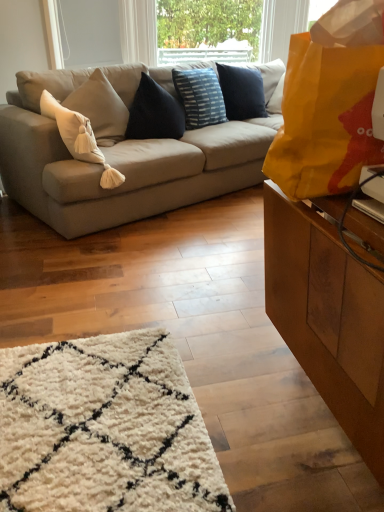
Describe the element at coordinates (200, 97) in the screenshot. I see `blue striped cushion at center, positioned as the 1th pillow in back-to-front order` at that location.

The width and height of the screenshot is (384, 512). What do you see at coordinates (329, 103) in the screenshot?
I see `yellow paper bag at right` at bounding box center [329, 103].

You are a GUI agent. You are given a task and a screenshot of the screen. Output one action in this format:
    pyautogui.click(x=<x>, y=<y>)
    Task: Click on the blue striped cushion at center, which is the 2th pillow from left to right
    
    Given the screenshot: What is the action you would take?
    [200, 97]

Which is correct: yellow paper bag at right is inside white soft cushion at left, acting as the second pillow starting from the back, or outside of it?

yellow paper bag at right lies outside white soft cushion at left, acting as the second pillow starting from the back.

Considering the points (310, 116) and (43, 104), which point is in front, point (310, 116) or point (43, 104)?

The point (310, 116) is in front.

How much distance is there between yellow paper bag at right and white soft cushion at left, acting as the second pillow starting from the back?

yellow paper bag at right and white soft cushion at left, acting as the second pillow starting from the back, are 4.88 feet apart from each other.

Based on the photo, considering the positions of objects blue striped cushion at center, which is the 2th pillow from left to right, and white soft cushion at left, the first pillow viewed from the front, in the image provided, who is more to the left, blue striped cushion at center, which is the 2th pillow from left to right, or white soft cushion at left, the first pillow viewed from the front,?

From the viewer's perspective, white soft cushion at left, the first pillow viewed from the front, appears more on the left side.

Locate an element on the screen. The width and height of the screenshot is (384, 512). pillow above the white soft cushion at left, the first pillow viewed from the front (from the image's perspective) is located at coordinates (200, 97).

From the image's perspective, is blue striped cushion at center, arranged as the second pillow when viewed from the front, located beneath white soft cushion at left, acting as the second pillow starting from the back?

Actually, blue striped cushion at center, arranged as the second pillow when viewed from the front, appears above white soft cushion at left, acting as the second pillow starting from the back, in the image.

Considering the sizes of objects white soft cushion at left, the first pillow viewed from the front, and yellow paper bag at right in the image provided, who is taller, white soft cushion at left, the first pillow viewed from the front, or yellow paper bag at right?

white soft cushion at left, the first pillow viewed from the front.

Considering the relative sizes of white soft cushion at left, positioned as the 2th pillow in right-to-left order, and yellow paper bag at right in the image provided, is white soft cushion at left, positioned as the 2th pillow in right-to-left order, thinner than yellow paper bag at right?

No, white soft cushion at left, positioned as the 2th pillow in right-to-left order, is not thinner than yellow paper bag at right.

Is white soft cushion at left, the 1th pillow viewed from the left, looking in the opposite direction of yellow paper bag at right?

No, white soft cushion at left, the 1th pillow viewed from the left,'s orientation is not away from yellow paper bag at right.

Which is more to the left, white soft cushion at left, the 1th pillow viewed from the left, or yellow paper bag at right?

Positioned to the left is white soft cushion at left, the 1th pillow viewed from the left.

Does beige fabric couch at center have a lesser height compared to white soft cushion at left, the first pillow viewed from the front?

Incorrect, the height of beige fabric couch at center does not fall short of that of white soft cushion at left, the first pillow viewed from the front.

Is beige fabric couch at center next to white soft cushion at left, positioned as the 2th pillow in right-to-left order?

There is a gap between beige fabric couch at center and white soft cushion at left, positioned as the 2th pillow in right-to-left order.

In the scene shown: From the image's perspective, between beige fabric couch at center and white soft cushion at left, the first pillow viewed from the front, which one is located above?

beige fabric couch at center is shown above in the image.

Is beige fabric couch at center facing away from white soft cushion at left, acting as the second pillow starting from the back?

No, beige fabric couch at center is not facing the opposite direction of white soft cushion at left, acting as the second pillow starting from the back.

Between blue striped cushion at center, the 1th pillow positioned from the right, and beige fabric couch at center, which one appears on the left side from the viewer's perspective?

Answer: From the viewer's perspective, beige fabric couch at center appears more on the left side.

Would you consider blue striped cushion at center, arranged as the second pillow when viewed from the front, to be distant from beige fabric couch at center?

No, blue striped cushion at center, arranged as the second pillow when viewed from the front, is in close proximity to beige fabric couch at center.

Considering the relative sizes of blue striped cushion at center, positioned as the 1th pillow in back-to-front order, and beige fabric couch at center in the image provided, is blue striped cushion at center, positioned as the 1th pillow in back-to-front order, wider than beige fabric couch at center?

In fact, blue striped cushion at center, positioned as the 1th pillow in back-to-front order, might be narrower than beige fabric couch at center.

Which is nearer, (194,122) or (354,36)?

Point (194,122) appears to be farther away from the viewer than point (354,36).

Could you measure the distance between blue striped cushion at center, positioned as the 1th pillow in back-to-front order, and yellow paper bag at right?

blue striped cushion at center, positioned as the 1th pillow in back-to-front order, is 2.16 meters away from yellow paper bag at right.

Is blue striped cushion at center, positioned as the 1th pillow in back-to-front order, wider than yellow paper bag at right?

In fact, blue striped cushion at center, positioned as the 1th pillow in back-to-front order, might be narrower than yellow paper bag at right.

Considering the relative sizes of blue striped cushion at center, arranged as the second pillow when viewed from the front, and yellow paper bag at right in the image provided, is blue striped cushion at center, arranged as the second pillow when viewed from the front, bigger than yellow paper bag at right?

Yes.

How many degrees apart are the facing directions of white soft cushion at left, the first pillow viewed from the front, and blue striped cushion at center, arranged as the second pillow when viewed from the front?

They differ by 8.03 degrees in their facing directions.

In the scene shown: Is white soft cushion at left, the first pillow viewed from the front, surrounding blue striped cushion at center, arranged as the second pillow when viewed from the front?

No, blue striped cushion at center, arranged as the second pillow when viewed from the front, is not a part of white soft cushion at left, the first pillow viewed from the front.

Considering the positions of objects white soft cushion at left, the first pillow viewed from the front, and blue striped cushion at center, arranged as the second pillow when viewed from the front, in the image provided, who is more to the right, white soft cushion at left, the first pillow viewed from the front, or blue striped cushion at center, arranged as the second pillow when viewed from the front,?

blue striped cushion at center, arranged as the second pillow when viewed from the front, is more to the right.

From a real-world perspective, who is located higher, white soft cushion at left, the first pillow viewed from the front, or blue striped cushion at center, arranged as the second pillow when viewed from the front?

In real-world perspective, blue striped cushion at center, arranged as the second pillow when viewed from the front, is above.

Find the location of a particular element. The width and height of the screenshot is (384, 512). bag above the white soft cushion at left, acting as the second pillow starting from the back (from a real-world perspective) is located at coordinates (329, 103).

Identify the location of pillow that is behind the white soft cushion at left, the 1th pillow viewed from the left. Image resolution: width=384 pixels, height=512 pixels. (200, 97).

Looking at the image, which one is located further to white soft cushion at left, the 1th pillow viewed from the left, beige fabric couch at center or yellow paper bag at right?

The object further to white soft cushion at left, the 1th pillow viewed from the left, is yellow paper bag at right.

When comparing their distances from blue striped cushion at center, which is the 2th pillow from left to right, does white soft cushion at left, the 1th pillow viewed from the left, or yellow paper bag at right seem closer?

white soft cushion at left, the 1th pillow viewed from the left, is closer to blue striped cushion at center, which is the 2th pillow from left to right.

From the image, which object appears to be farther from beige fabric couch at center, white soft cushion at left, the first pillow viewed from the front, or yellow paper bag at right?

Based on the image, yellow paper bag at right appears to be further to beige fabric couch at center.

Consider the image. Which object lies further to the anchor point yellow paper bag at right, blue striped cushion at center, which is the 2th pillow from left to right, or beige fabric couch at center?

The object further to yellow paper bag at right is blue striped cushion at center, which is the 2th pillow from left to right.

From the image, which object appears to be farther from white soft cushion at left, acting as the second pillow starting from the back, blue striped cushion at center, arranged as the second pillow when viewed from the front, or beige fabric couch at center?

Based on the image, blue striped cushion at center, arranged as the second pillow when viewed from the front, appears to be further to white soft cushion at left, acting as the second pillow starting from the back.

Estimate the real-world distances between objects in this image. Which object is closer to blue striped cushion at center, the 1th pillow positioned from the right, beige fabric couch at center or white soft cushion at left, acting as the second pillow starting from the back?

Based on the image, beige fabric couch at center appears to be nearer to blue striped cushion at center, the 1th pillow positioned from the right.

Based on their spatial positions, is blue striped cushion at center, positioned as the 1th pillow in back-to-front order, or yellow paper bag at right closer to beige fabric couch at center?

Based on the image, blue striped cushion at center, positioned as the 1th pillow in back-to-front order, appears to be nearer to beige fabric couch at center.

Which object lies nearer to the anchor point beige fabric couch at center, yellow paper bag at right or white soft cushion at left, acting as the second pillow starting from the back?

The object closer to beige fabric couch at center is white soft cushion at left, acting as the second pillow starting from the back.

Locate an element on the screen. Image resolution: width=384 pixels, height=512 pixels. pillow between yellow paper bag at right and blue striped cushion at center, which is the 2th pillow from left to right, along the z-axis is located at coordinates (79, 138).

Where is `pillow located between beige fabric couch at center and blue striped cushion at center, arranged as the second pillow when viewed from the front, in the depth direction`? pillow located between beige fabric couch at center and blue striped cushion at center, arranged as the second pillow when viewed from the front, in the depth direction is located at coordinates (79, 138).

Identify the location of studio couch located between yellow paper bag at right and white soft cushion at left, positioned as the 2th pillow in right-to-left order, in the depth direction. This screenshot has height=512, width=384. (125, 170).

What are the coordinates of `studio couch positioned between yellow paper bag at right and blue striped cushion at center, arranged as the second pillow when viewed from the front, from near to far` in the screenshot? It's located at (125, 170).